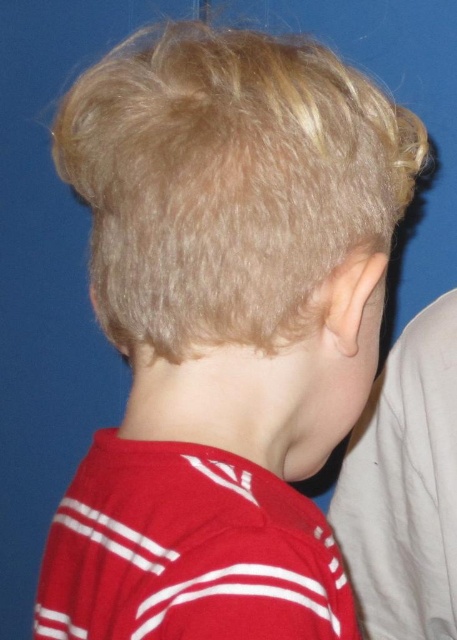
Does red striped jersey at center have a lesser height compared to smooth skin ear at center?

Indeed, red striped jersey at center has a lesser height compared to smooth skin ear at center.

Can you confirm if red striped jersey at center is positioned to the left of smooth skin ear at center?

Correct, you'll find red striped jersey at center to the left of smooth skin ear at center.

Who is more distant from viewer, (70, 593) or (425, 628)?

The point (425, 628) is more distant.

The width and height of the screenshot is (457, 640). I want to click on red striped jersey at center, so [x=187, y=552].